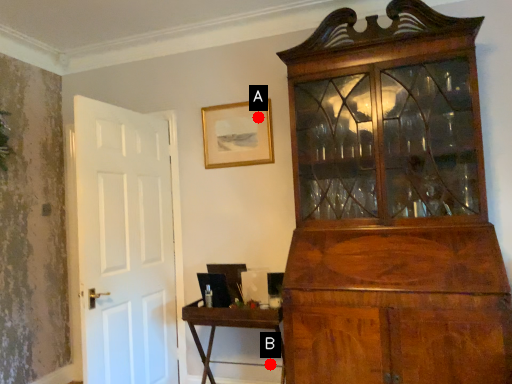
Question: Two points are circled on the image, labeled by A and B beside each circle. Among these points, which one is farthest from the camera?

Choices:
 (A) A is further
 (B) B is further

Answer: (A)